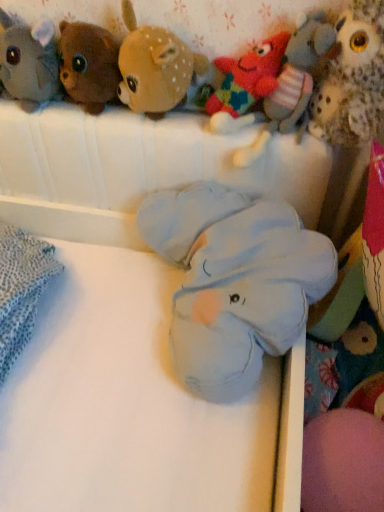
The height and width of the screenshot is (512, 384). What do you see at coordinates (292, 85) in the screenshot?
I see `fluffy plush star at upper right, acting as the 2th toy starting from the right` at bounding box center [292, 85].

Describe the element at coordinates (245, 84) in the screenshot. I see `knitted wool starfish at upper center, marked as the 3th toy in a right-to-left arrangement` at that location.

I want to click on fluffy brown owl at upper right, acting as the 1th toy starting from the right, so click(x=353, y=80).

I want to click on soft blue plush elephant at center, so click(x=128, y=318).

Consider the image. What is the approximate width of soft blue plush elephant at center, which appears as the fourth toy when viewed from the right?

It is 39.09 centimeters.

At what (x,y) coordinates should I click in order to perform the action: click on fluffy plush star at upper right, acting as the 2th toy starting from the right. Please return your answer as a coordinate pair (x, y). The image size is (384, 512). Looking at the image, I should click on (292, 85).

From a real-world perspective, is soft plush deer at upper center, the 3th toy from the left, over soft plush bear at upper left, which is the 1th toy in left-to-right order?

Indeed, from a real-world perspective, soft plush deer at upper center, the 3th toy from the left, stands above soft plush bear at upper left, which is the 1th toy in left-to-right order.

Considering the sizes of objects soft plush deer at upper center, which is the 5th toy from right to left, and soft plush bear at upper left, arranged as the 7th toy when viewed from the right, in the image provided, who is shorter, soft plush deer at upper center, which is the 5th toy from right to left, or soft plush bear at upper left, arranged as the 7th toy when viewed from the right,?

soft plush bear at upper left, arranged as the 7th toy when viewed from the right.

Considering the sizes of objects soft plush deer at upper center, which is the 5th toy from right to left, and soft plush bear at upper left, arranged as the 7th toy when viewed from the right, in the image provided, who is smaller, soft plush deer at upper center, which is the 5th toy from right to left, or soft plush bear at upper left, arranged as the 7th toy when viewed from the right,?

With smaller size is soft plush bear at upper left, arranged as the 7th toy when viewed from the right.

Which of these two, fluffy brown owl at upper right, which appears as the seventh toy when viewed from the left, or soft plush deer at upper center, which is the 5th toy from right to left, stands shorter?

soft plush deer at upper center, which is the 5th toy from right to left, is shorter.

Find the location of a particular element. toy above the soft plush deer at upper center, which is the 5th toy from right to left (from a real-world perspective) is located at coordinates (353, 80).

From the image's perspective, which is below, fluffy brown owl at upper right, which appears as the seventh toy when viewed from the left, or soft plush deer at upper center, which is the 5th toy from right to left?

fluffy brown owl at upper right, which appears as the seventh toy when viewed from the left, is shown below in the image.

Do you think fluffy brown owl at upper right, which appears as the seventh toy when viewed from the left, is within soft plush deer at upper center, which is the 5th toy from right to left, or outside of it?

fluffy brown owl at upper right, which appears as the seventh toy when viewed from the left, is not inside soft plush deer at upper center, which is the 5th toy from right to left, it's outside.

Measure the distance from fluffy brown owl at upper right, which appears as the seventh toy when viewed from the left, to soft plush bear at upper left, arranged as the 7th toy when viewed from the right.

fluffy brown owl at upper right, which appears as the seventh toy when viewed from the left, and soft plush bear at upper left, arranged as the 7th toy when viewed from the right, are 22.16 inches apart from each other.

Is the position of fluffy brown owl at upper right, which appears as the seventh toy when viewed from the left, more distant than that of soft plush bear at upper left, which is the 1th toy in left-to-right order?

No, fluffy brown owl at upper right, which appears as the seventh toy when viewed from the left, is closer to the viewer.

From the image's perspective, does fluffy brown owl at upper right, acting as the 1th toy starting from the right, appear higher than soft plush bear at upper left, which is the 1th toy in left-to-right order?

Incorrect, from the image's perspective, fluffy brown owl at upper right, acting as the 1th toy starting from the right, is lower than soft plush bear at upper left, which is the 1th toy in left-to-right order.

Can you tell me how much fluffy brown owl at upper right, which appears as the seventh toy when viewed from the left, and soft plush bear at upper left, which is the 1th toy in left-to-right order, differ in facing direction?

They differ by 0.00087 degrees in their facing directions.

Are soft plush deer at upper center, which is the 5th toy from right to left, and soft blue plush elephant at center, the fourth toy viewed from the left, located far from each other?

Actually, soft plush deer at upper center, which is the 5th toy from right to left, and soft blue plush elephant at center, the fourth toy viewed from the left, are a little close together.

In the scene shown: How far apart are soft plush deer at upper center, which is the 5th toy from right to left, and soft blue plush elephant at center, the fourth toy viewed from the left?

A distance of 13.02 inches exists between soft plush deer at upper center, which is the 5th toy from right to left, and soft blue plush elephant at center, the fourth toy viewed from the left.

From a real-world perspective, relative to soft blue plush elephant at center, the fourth toy viewed from the left, is soft plush deer at upper center, the 3th toy from the left, vertically above or below?

Clearly, from a real-world perspective, soft plush deer at upper center, the 3th toy from the left, is above soft blue plush elephant at center, the fourth toy viewed from the left.

From the image's perspective, between soft plush deer at upper center, which is the 5th toy from right to left, and soft blue plush elephant at center, the fourth toy viewed from the left, who is located below?

soft blue plush elephant at center, the fourth toy viewed from the left.

From the picture: In the image, is fluffy plush star at upper right, acting as the 2th toy starting from the right, on the left side or the right side of soft blue plush elephant at center, which appears as the fourth toy when viewed from the right?

Clearly, fluffy plush star at upper right, acting as the 2th toy starting from the right, is on the right of soft blue plush elephant at center, which appears as the fourth toy when viewed from the right, in the image.

Does fluffy plush star at upper right, positioned as the sixth toy in left-to-right order, turn towards soft blue plush elephant at center, the fourth toy viewed from the left?

No, fluffy plush star at upper right, positioned as the sixth toy in left-to-right order, is not oriented towards soft blue plush elephant at center, the fourth toy viewed from the left.

Can you confirm if fluffy plush star at upper right, acting as the 2th toy starting from the right, is smaller than soft blue plush elephant at center, the fourth toy viewed from the left?

Indeed, fluffy plush star at upper right, acting as the 2th toy starting from the right, has a smaller size compared to soft blue plush elephant at center, the fourth toy viewed from the left.

You are a GUI agent. You are given a task and a screenshot of the screen. Output one action in this format:
    pyautogui.click(x=<x>, y=<y>)
    Task: Click on the 4th toy directly beneath the soft plush deer at upper center, the 3th toy from the left (from a real-world perspective)
    The image size is (384, 512).
    Given the screenshot: What is the action you would take?
    pyautogui.click(x=292, y=85)

Which of these two, soft plush deer at upper center, the 3th toy from the left, or fluffy plush star at upper right, acting as the 2th toy starting from the right, is bigger?

fluffy plush star at upper right, acting as the 2th toy starting from the right, is bigger.

Is soft plush deer at upper center, the 3th toy from the left, situated inside fluffy plush star at upper right, acting as the 2th toy starting from the right, or outside?

soft plush deer at upper center, the 3th toy from the left, is outside fluffy plush star at upper right, acting as the 2th toy starting from the right.

Looking at this image, between soft plush deer at upper center, the 3th toy from the left, and fluffy plush star at upper right, acting as the 2th toy starting from the right, which one appears on the left side from the viewer's perspective?

From the viewer's perspective, soft plush deer at upper center, the 3th toy from the left, appears more on the left side.

How different are the orientations of soft blue plush elephant at center, which appears as the fourth toy when viewed from the right, and soft blue plush elephant at center in degrees?

0.000144 degrees separate the facing orientations of soft blue plush elephant at center, which appears as the fourth toy when viewed from the right, and soft blue plush elephant at center.

Between soft blue plush elephant at center, the fourth toy viewed from the left, and soft blue plush elephant at center, which one has more height?

soft blue plush elephant at center is taller.

Considering the sizes of objects soft blue plush elephant at center, which appears as the fourth toy when viewed from the right, and soft blue plush elephant at center in the image provided, who is wider, soft blue plush elephant at center, which appears as the fourth toy when viewed from the right, or soft blue plush elephant at center?

Wider between the two is soft blue plush elephant at center.

From the image's perspective, is soft blue plush elephant at center, the fourth toy viewed from the left, positioned above or below soft blue plush elephant at center?

soft blue plush elephant at center, the fourth toy viewed from the left, is situated higher than soft blue plush elephant at center in the image.

Identify the location of toy that is the 2nd object located below the soft plush bear at upper left, which is the 1th toy in left-to-right order (from the image's perspective). (155, 67).

Find the location of a particular element. Image resolution: width=384 pixels, height=512 pixels. toy that is the 2nd one when counting backward from the fluffy brown owl at upper right, which appears as the seventh toy when viewed from the left is located at coordinates (155, 67).

Looking at the image, which one is located closer to soft plush bear at upper left, which is the 1th toy in left-to-right order, fluffy brown owl at upper right, acting as the 1th toy starting from the right, or fluffy plush star at upper right, positioned as the sixth toy in left-to-right order?

Based on the image, fluffy plush star at upper right, positioned as the sixth toy in left-to-right order, appears to be nearer to soft plush bear at upper left, which is the 1th toy in left-to-right order.

Estimate the real-world distances between objects in this image. Which object is further from soft plush deer at upper center, the 3th toy from the left, soft plush bear at upper left, arranged as the 7th toy when viewed from the right, or fluffy plush star at upper right, acting as the 2th toy starting from the right?

fluffy plush star at upper right, acting as the 2th toy starting from the right, is further to soft plush deer at upper center, the 3th toy from the left.

Considering their positions, is knitted wool starfish at upper center, arranged as the fifth toy when viewed from the left, positioned further to brown plush bear at upper left, which is the 6th toy from right to left, than soft blue plush elephant at center, which appears as the fourth toy when viewed from the right?

soft blue plush elephant at center, which appears as the fourth toy when viewed from the right.

From the image, which object appears to be nearer to fluffy brown owl at upper right, acting as the 1th toy starting from the right, fluffy plush star at upper right, acting as the 2th toy starting from the right, or brown plush bear at upper left, which is the 6th toy from right to left?

The object closer to fluffy brown owl at upper right, acting as the 1th toy starting from the right, is fluffy plush star at upper right, acting as the 2th toy starting from the right.

Which object lies further to the anchor point brown plush bear at upper left, which is the 6th toy from right to left, fluffy plush star at upper right, positioned as the sixth toy in left-to-right order, or fluffy brown owl at upper right, which appears as the seventh toy when viewed from the left?

Based on the image, fluffy brown owl at upper right, which appears as the seventh toy when viewed from the left, appears to be further to brown plush bear at upper left, which is the 6th toy from right to left.

Estimate the real-world distances between objects in this image. Which object is closer to soft plush bear at upper left, arranged as the 7th toy when viewed from the right, soft plush deer at upper center, which is the 5th toy from right to left, or fluffy plush star at upper right, acting as the 2th toy starting from the right?

The object closer to soft plush bear at upper left, arranged as the 7th toy when viewed from the right, is soft plush deer at upper center, which is the 5th toy from right to left.

Based on their spatial positions, is brown plush bear at upper left, which is the 6th toy from right to left, or fluffy brown owl at upper right, which appears as the seventh toy when viewed from the left, further from soft blue plush elephant at center, which appears as the fourth toy when viewed from the right?

brown plush bear at upper left, which is the 6th toy from right to left, is further to soft blue plush elephant at center, which appears as the fourth toy when viewed from the right.

From the picture: Which object lies nearer to the anchor point soft blue plush elephant at center, brown plush bear at upper left, which is the 6th toy from right to left, or soft plush bear at upper left, arranged as the 7th toy when viewed from the right?

Among the two, brown plush bear at upper left, which is the 6th toy from right to left, is located nearer to soft blue plush elephant at center.

Where is `toy between fluffy plush star at upper right, positioned as the sixth toy in left-to-right order, and soft blue plush elephant at center in the up-down direction`? toy between fluffy plush star at upper right, positioned as the sixth toy in left-to-right order, and soft blue plush elephant at center in the up-down direction is located at coordinates (234, 281).

The width and height of the screenshot is (384, 512). I want to click on toy between knitted wool starfish at upper center, marked as the 3th toy in a right-to-left arrangement, and fluffy brown owl at upper right, which appears as the seventh toy when viewed from the left, from left to right, so click(292, 85).

Locate an element on the screen. toy between soft plush bear at upper left, arranged as the 7th toy when viewed from the right, and soft plush deer at upper center, which is the 5th toy from right to left is located at coordinates (89, 65).

Find the location of `infant bed between soft plush bear at upper left, arranged as the 7th toy when viewed from the right, and fluffy brown owl at upper right, which appears as the seventh toy when viewed from the left`. infant bed between soft plush bear at upper left, arranged as the 7th toy when viewed from the right, and fluffy brown owl at upper right, which appears as the seventh toy when viewed from the left is located at coordinates pos(128,318).